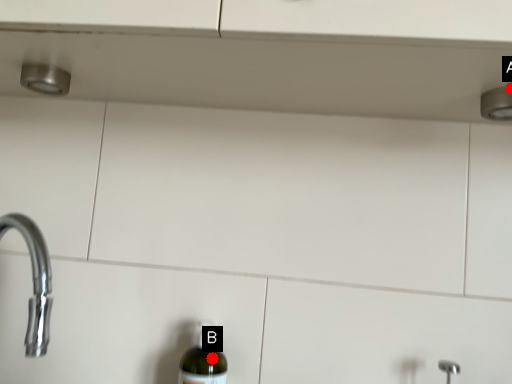
Question: Two points are circled on the image, labeled by A and B beside each circle. Which of the following is the farthest from the observer?

Choices:
 (A) A is further
 (B) B is further

Answer: (B)